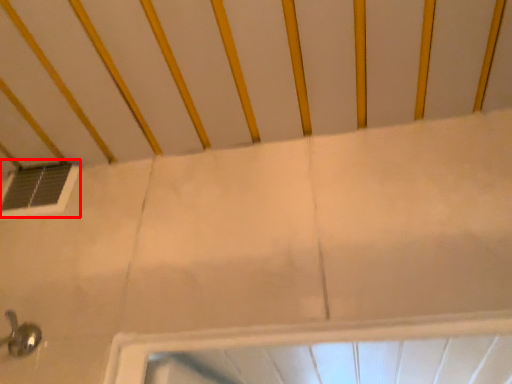
Question: Where is window (annotated by the red box) located in relation to infant bed in the image?

Choices:
 (A) right
 (B) left

Answer: (B)